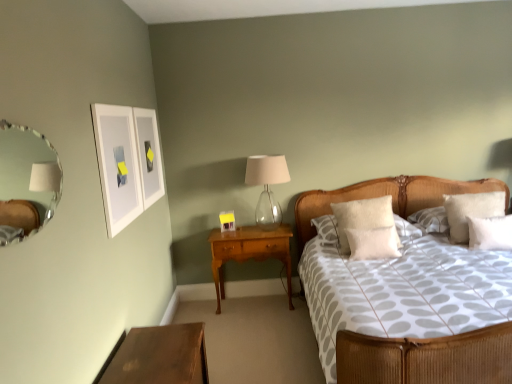
Locate an element on the screen. The image size is (512, 384). free point above wooden nightstand at lower left, marked as the first nightstand in a front-to-back arrangement (from a real-world perspective) is located at coordinates (155, 349).